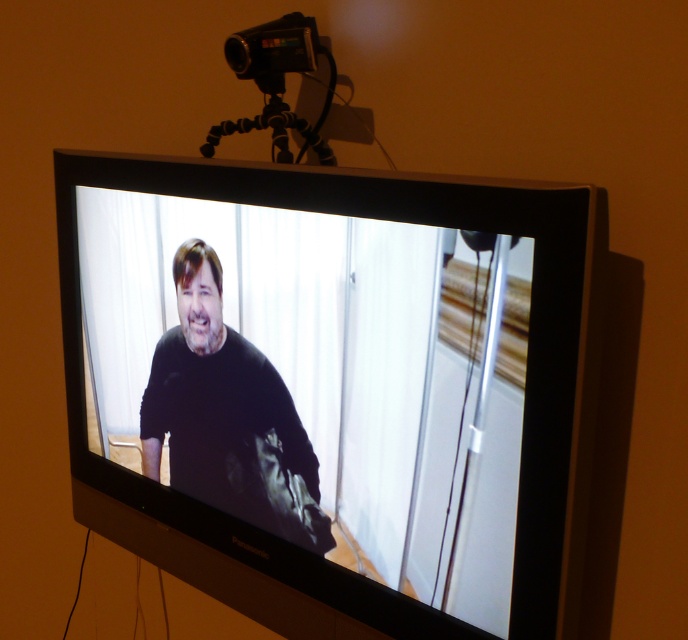
You are a film student analyzing the setup of this scene. You notice the black matte shirt at center and the black plastic video camera at upper center. Which object is located closer to the bottom of the image?

The black matte shirt at center is positioned under the black plastic video camera at upper center, so the black matte shirt at center is closer to the bottom of the image.

You are setting up a video call and need to adjust the camera angle. The black plastic video camera at upper center and the black rubber tripod at upper center are both part of your setup. Which object should you adjust to position the camera higher?

The black plastic video camera at upper center is above the black rubber tripod at upper center, so adjusting the black rubber tripod at upper center would allow you to position the camera higher or lower.